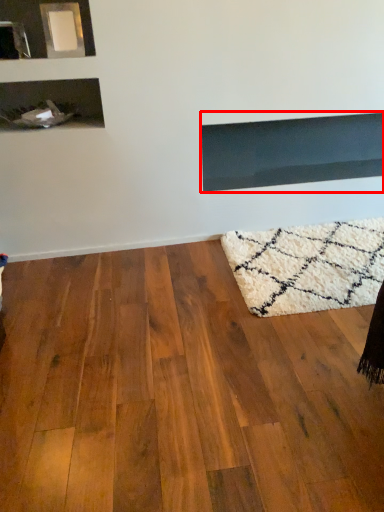
Question: From the image's perspective, where is fireplace (annotated by the red box) located in relation to hardwood in the image?

Choices:
 (A) above
 (B) below

Answer: (A)